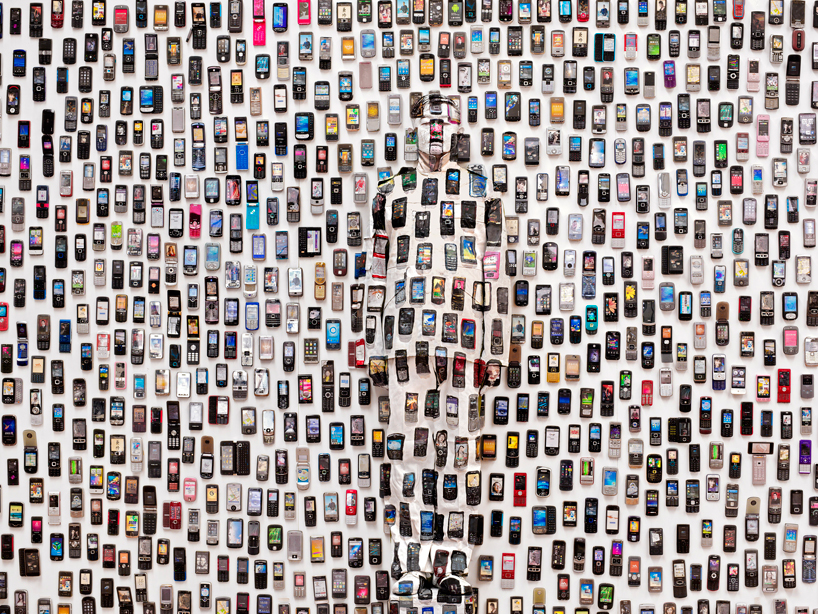
I want to click on phone, so click(x=771, y=552).